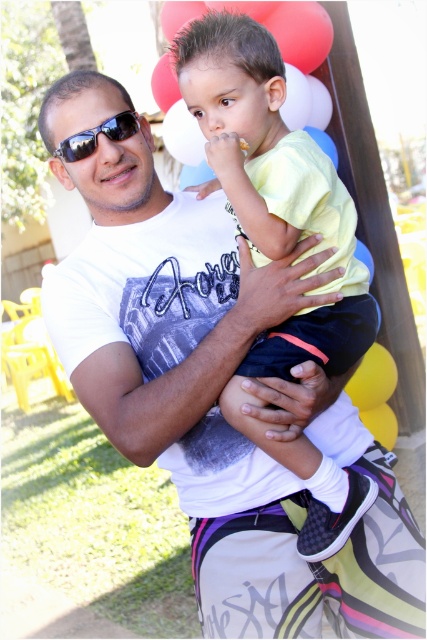
Is point (365, 388) in front of point (190, 131)?

No.

Does yellow matte balloon at center have a greater height compared to white matte balloon at upper center?

No.

Between point (397, 372) and point (178, 116), which one is positioned behind?

Positioned behind is point (397, 372).

This screenshot has height=640, width=427. I want to click on yellow matte balloon at center, so click(x=373, y=378).

Is the position of red matte balloon at upper center less distant than that of yellow matte balloon at center?

Yes, it is in front of yellow matte balloon at center.

Is point (328, 49) positioned after point (376, 376)?

No, it is not.

Locate an element on the screen. This screenshot has width=427, height=640. red matte balloon at upper center is located at coordinates (301, 33).

Does red matte balloon at upper center have a greater width compared to white matte balloon at upper center?

Yes.

Can you confirm if red matte balloon at upper center is thinner than white matte balloon at upper center?

Incorrect, red matte balloon at upper center's width is not less than white matte balloon at upper center's.

Is point (283, 60) less distant than point (169, 131)?

Yes.

Image resolution: width=427 pixels, height=640 pixels. In order to click on red matte balloon at upper center in this screenshot , I will do `click(301, 33)`.